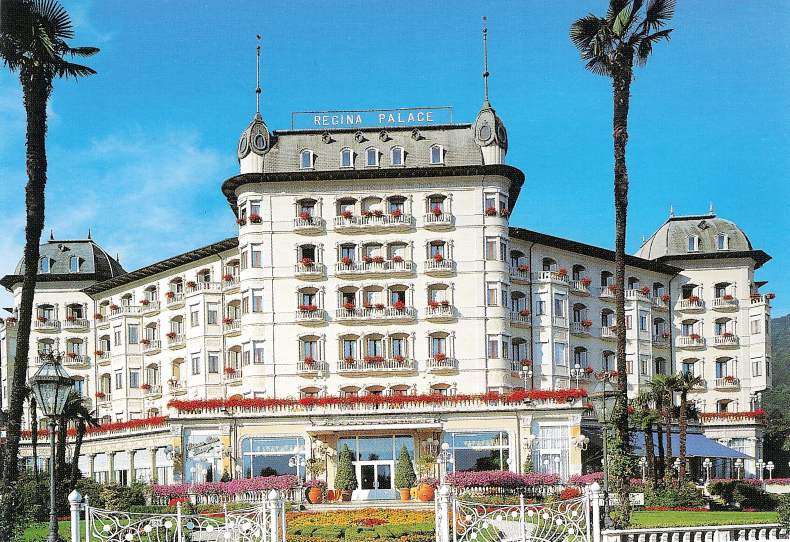
Identify the location of light with black post. This screenshot has height=542, width=790. (47, 391).